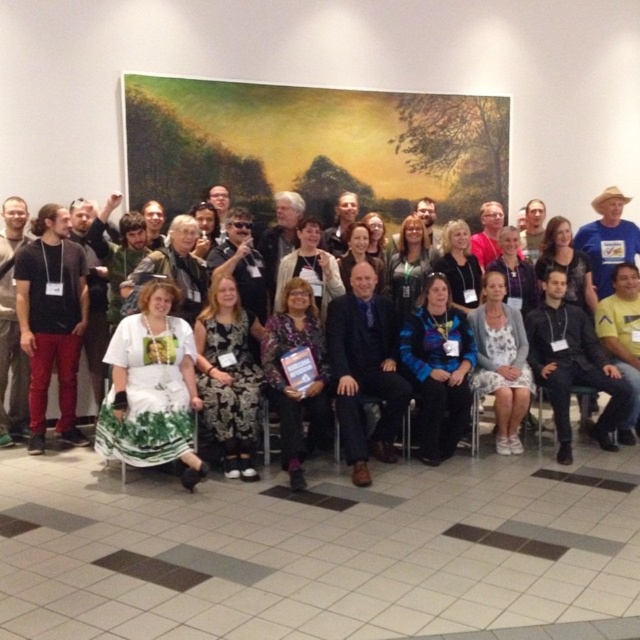
Which is below, white lace dress at center or white printed dress at lower left?

Positioned lower is white printed dress at lower left.

Can you confirm if white lace dress at center is positioned to the left of white printed dress at lower left?

Yes, white lace dress at center is to the left of white printed dress at lower left.

Where is `white lace dress at center`? The width and height of the screenshot is (640, 640). white lace dress at center is located at coordinates (35, 337).